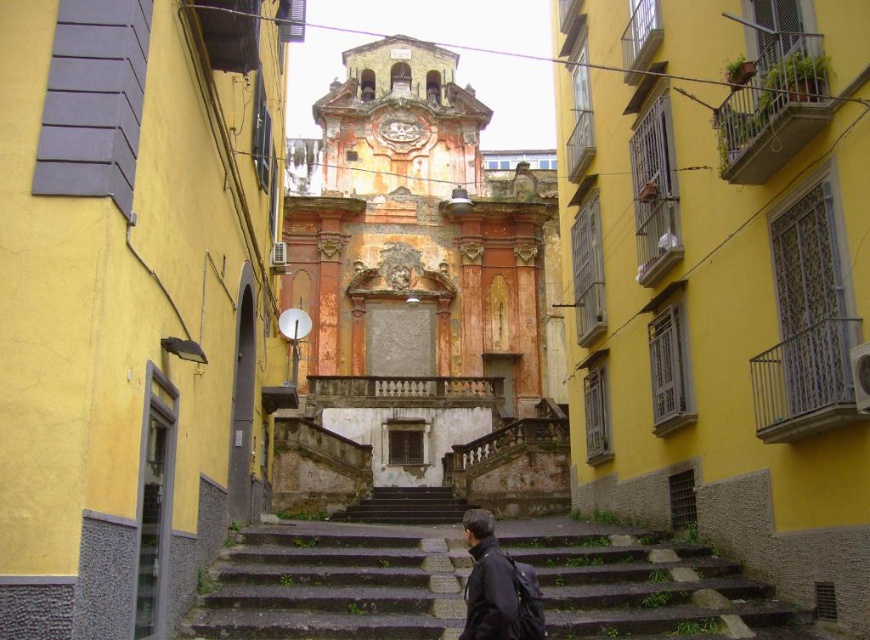
You are a delivery person with a package that is 1.2 meters wide. You need to navigate through the narrow alleyway. The alleyway has the rustic stone church at center and the dark matte jacket at lower center. Which object will you have to maneuver around first, and will your package fit through the narrowest point between them?

The dark matte jacket at lower center is narrower than the rustic stone church at center. Since the package is 1.2 meters wide, you will first encounter the dark matte jacket at lower center and need to check if the narrowest point between them allows passage. However, the exact width isn not provided, so proceed with caution.

You are standing at the entrance of the alleyway and want to reach the dark gray concrete stairs at center. Is the rustic stone church at center blocking your direct path?

The rustic stone church at center is closer to the viewer than the dark gray concrete stairs at center, so the church is blocking the direct path to the stairs.